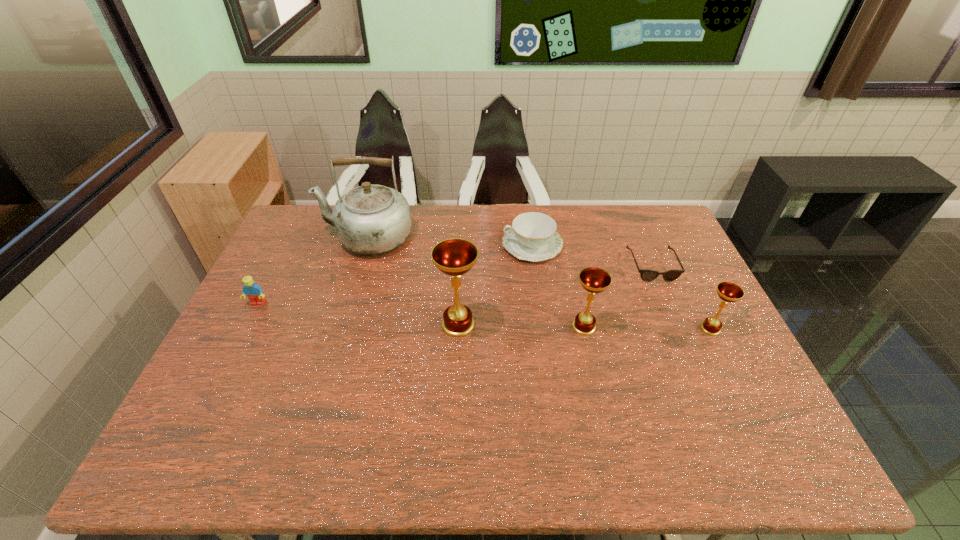
Locate an element on the screen. The image size is (960, 540). vacant space at the left edge is located at coordinates (208, 372).

Find the location of a particular element. This screenshot has height=540, width=960. vacant space at the right edge of the desktop is located at coordinates (681, 331).

Identify the location of vacant region at the far left corner of the desktop. (310, 234).

The image size is (960, 540). In the image, there is a desktop. Identify the location of free space at the far right corner. (645, 239).

You are a GUI agent. You are given a task and a screenshot of the screen. Output one action in this format:
    pyautogui.click(x=<x>, y=<y>)
    Task: Click on the vacant area that lies between the second tallest chalice and the sixth object from right to left
    The width and height of the screenshot is (960, 540).
    Given the screenshot: What is the action you would take?
    pyautogui.click(x=475, y=282)

Image resolution: width=960 pixels, height=540 pixels. Identify the location of free space that is in between the sixth tallest object and the tallest chalice. (495, 285).

This screenshot has width=960, height=540. What are the coordinates of `unoccupied area between the kettle and the leftmost chalice` in the screenshot? It's located at (413, 281).

Find the location of a particular element. This screenshot has width=960, height=540. free space between the third object from left to right and the leftmost object is located at coordinates point(358,314).

Locate an element on the screen. The height and width of the screenshot is (540, 960). blank region between the fourth shortest object and the kettle is located at coordinates (539, 283).

Locate an element on the screen. The height and width of the screenshot is (540, 960). vacant area that lies between the kettle and the leftmost object is located at coordinates (313, 270).